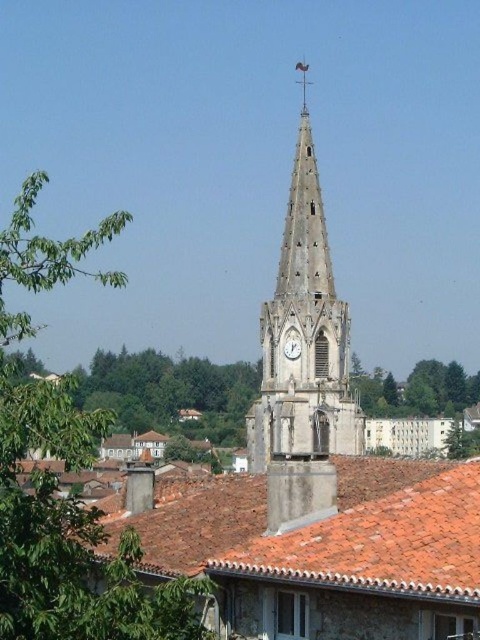
Question: Does green leafy tree at left appear over red clay tiles at center?

Choices:
 (A) no
 (B) yes

Answer: (B)

Question: Which point appears farthest from the camera in this image?

Choices:
 (A) (288, 499)
 (B) (236, 528)
 (C) (424, 401)

Answer: (C)

Question: Which of the following is the closest to the observer?

Choices:
 (A) (422, 387)
 (B) (291, 214)

Answer: (B)

Question: Estimate the real-world distances between objects in this image. Which object is closer to the green leafy tree at left?

Choices:
 (A) white stone clock at center
 (B) stone clock tower at center

Answer: (B)

Question: Where is stone clock tower at center located in relation to green leafy tree at center in the image?

Choices:
 (A) right
 (B) left

Answer: (B)

Question: Can you confirm if green leafy tree at left is thinner than white stone clock at center?

Choices:
 (A) no
 (B) yes

Answer: (A)